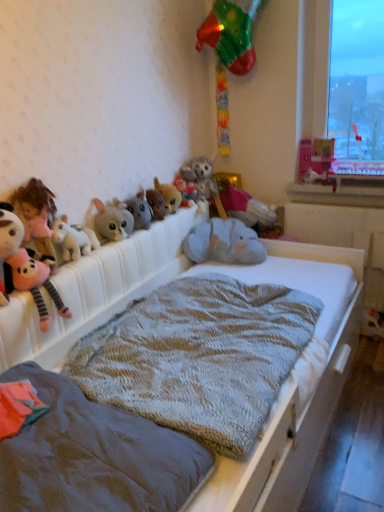
This screenshot has height=512, width=384. What are the coordinates of `fluffy pink doll at left, which is the 2th toy from left to right` in the screenshot? It's located at tap(36, 218).

The image size is (384, 512). Describe the element at coordinates (73, 239) in the screenshot. I see `white plush unicorn at left, which is the eighth toy in right-to-left order` at that location.

Where is `fluffy gray elephant at center, which is counted as the seventh toy, starting from the left`? The width and height of the screenshot is (384, 512). fluffy gray elephant at center, which is counted as the seventh toy, starting from the left is located at coordinates (186, 191).

What do you see at coordinates (186, 191) in the screenshot? This screenshot has height=512, width=384. I see `fluffy gray elephant at center, which is the 4th toy from right to left` at bounding box center [186, 191].

This screenshot has width=384, height=512. What do you see at coordinates (242, 281) in the screenshot?
I see `textured gray blanket at center` at bounding box center [242, 281].

Locate an element on the screen. fluffy gray stuffed animal at center is located at coordinates (199, 176).

I want to click on fluffy gray plush at center, the sixth toy when ordered from right to left, so click(x=140, y=210).

Locate an element on the screen. fluffy pink doll at left, which is the 2th toy from left to right is located at coordinates (36, 218).

Which of these two, fluffy gray plush at center, positioned as the 5th toy in left-to-right order, or textured gray blanket at center, is thinner?

With smaller width is fluffy gray plush at center, positioned as the 5th toy in left-to-right order.

Can you tell me how much fluffy gray plush at center, the sixth toy when ordered from right to left, and textured gray blanket at center differ in facing direction?

The facing directions of fluffy gray plush at center, the sixth toy when ordered from right to left, and textured gray blanket at center are 0.00123 degrees apart.

Is fluffy gray plush at center, the sixth toy when ordered from right to left, bigger than textured gray blanket at center?

Actually, fluffy gray plush at center, the sixth toy when ordered from right to left, might be smaller than textured gray blanket at center.

From the image's perspective, which one is positioned higher, fluffy gray plush at center, the sixth toy when ordered from right to left, or pink plush toy at left, acting as the tenth toy starting from the right?

fluffy gray plush at center, the sixth toy when ordered from right to left, from the image's perspective.

Who is bigger, fluffy gray plush at center, the sixth toy when ordered from right to left, or pink plush toy at left, which is counted as the first toy, starting from the left?

Bigger between the two is fluffy gray plush at center, the sixth toy when ordered from right to left.

Is fluffy gray plush at center, the sixth toy when ordered from right to left, not near pink plush toy at left, which is counted as the first toy, starting from the left?

fluffy gray plush at center, the sixth toy when ordered from right to left, is near pink plush toy at left, which is counted as the first toy, starting from the left, not far away.

From a real-world perspective, which is physically above, fluffy gray plush at center, the sixth toy when ordered from right to left, or pink plush toy at left, acting as the tenth toy starting from the right?

In real-world perspective, pink plush toy at left, acting as the tenth toy starting from the right, is above.

Does pink plush toy at left, which is counted as the first toy, starting from the left, lie behind textured gray blanket at center, marked as the first blanket in a back-to-front arrangement?

Yes, it is.

Does pink plush toy at left, acting as the tenth toy starting from the right, have a lesser width compared to textured gray blanket at center, marked as the first blanket in a back-to-front arrangement?

Indeed, pink plush toy at left, acting as the tenth toy starting from the right, has a lesser width compared to textured gray blanket at center, marked as the first blanket in a back-to-front arrangement.

Considering the relative positions of pink plush toy at left, which is counted as the first toy, starting from the left, and textured gray blanket at center, marked as the first blanket in a back-to-front arrangement, in the image provided, is pink plush toy at left, which is counted as the first toy, starting from the left, to the left or to the right of textured gray blanket at center, marked as the first blanket in a back-to-front arrangement,?

From the image, it's evident that pink plush toy at left, which is counted as the first toy, starting from the left, is to the left of textured gray blanket at center, marked as the first blanket in a back-to-front arrangement.

There is a textured gray blanket at center, arranged as the 2th blanket when viewed from the front. At what (x,y) coordinates should I click in order to perform the action: click on the 1st toy above it (from the image's perspective). Please return your answer as a coordinate pair (x, y). Looking at the image, I should click on (x=8, y=247).

Between fluffy gray elephant at center, which is counted as the seventh toy, starting from the left, and fluffy gray plush at center, the 7th toy viewed from the right, which one has larger size?

With larger size is fluffy gray plush at center, the 7th toy viewed from the right.

Is fluffy gray elephant at center, which is counted as the seventh toy, starting from the left, positioned with its back to fluffy gray plush at center, which appears as the fourth toy when viewed from the left?

No.

From the image's perspective, which is above, fluffy gray elephant at center, which is counted as the seventh toy, starting from the left, or fluffy gray plush at center, the 7th toy viewed from the right?

From the image's view, fluffy gray elephant at center, which is counted as the seventh toy, starting from the left, is above.

Is point (7, 222) closer or farther from the camera than point (191, 195)?

Point (7, 222) is closer to the camera than point (191, 195).

Looking at this image, from a real-world perspective, between pink plush toy at left, acting as the tenth toy starting from the right, and fluffy gray elephant at center, which is counted as the seventh toy, starting from the left, who is vertically higher?

From a 3D spatial view, pink plush toy at left, acting as the tenth toy starting from the right, is above.

From the picture: What's the angular difference between pink plush toy at left, acting as the tenth toy starting from the right, and fluffy gray elephant at center, which is counted as the seventh toy, starting from the left,'s facing directions?

The angle between the facing direction of pink plush toy at left, acting as the tenth toy starting from the right, and the facing direction of fluffy gray elephant at center, which is counted as the seventh toy, starting from the left, is 5.29 degrees.

Is pink plush toy at left, which is counted as the first toy, starting from the left, taller than fluffy gray elephant at center, which is the 4th toy from right to left?

Correct, pink plush toy at left, which is counted as the first toy, starting from the left, is much taller as fluffy gray elephant at center, which is the 4th toy from right to left.

Based on their sizes in the image, would you say fluffy gray elephant at center, which is the 4th toy from right to left, is bigger or smaller than brown plush toy at upper center, positioned as the sixth toy in left-to-right order?

Considering their sizes, fluffy gray elephant at center, which is the 4th toy from right to left, takes up less space than brown plush toy at upper center, positioned as the sixth toy in left-to-right order.

Is brown plush toy at upper center, positioned as the 5th toy in right-to-left order, inside fluffy gray elephant at center, which is counted as the seventh toy, starting from the left?

That's incorrect, brown plush toy at upper center, positioned as the 5th toy in right-to-left order, is not inside fluffy gray elephant at center, which is counted as the seventh toy, starting from the left.

Could you measure the distance between fluffy gray elephant at center, which is counted as the seventh toy, starting from the left, and brown plush toy at upper center, positioned as the sixth toy in left-to-right order?

fluffy gray elephant at center, which is counted as the seventh toy, starting from the left, is 3.64 inches from brown plush toy at upper center, positioned as the sixth toy in left-to-right order.

Is fluffy gray elephant at center, which is the 4th toy from right to left, turned away from brown plush toy at upper center, positioned as the 5th toy in right-to-left order?

fluffy gray elephant at center, which is the 4th toy from right to left, does not have its back to brown plush toy at upper center, positioned as the 5th toy in right-to-left order.

How distant is fluffy gray plush at center, which appears as the fourth toy when viewed from the left, from fluffy gray stuffed animal at center?

64.47 centimeters.

Consider the image. Is fluffy gray stuffed animal at center completely or partially inside fluffy gray plush at center, the 7th toy viewed from the right?

No, fluffy gray plush at center, the 7th toy viewed from the right, does not contain fluffy gray stuffed animal at center.

Is fluffy gray plush at center, the 7th toy viewed from the right, smaller than fluffy gray stuffed animal at center?

Yes, fluffy gray plush at center, the 7th toy viewed from the right, is smaller than fluffy gray stuffed animal at center.

Find the location of a particular element. This screenshot has width=384, height=512. the 5th toy behind the textured gray blanket at center, starting your count from the anchor is located at coordinates (140, 210).

From a real-world perspective, starting from the pink plush toy at left, acting as the tenth toy starting from the right, which toy is the 2nd one below it? Please provide its 2D coordinates.

[(140, 210)]

Looking at the image, which one is located closer to fluffy gray elephant at center, which is the 4th toy from right to left, fluffy gray stuffed animal at center or pink plush toy at left, acting as the tenth toy starting from the right?

The object closer to fluffy gray elephant at center, which is the 4th toy from right to left, is fluffy gray stuffed animal at center.

From the image, which object appears to be nearer to fluffy gray stuffed animal at center, knitted gray blanket at center, which is the first blanket from front to back, or fluffy gray plush at center, the sixth toy when ordered from right to left?

Among the two, fluffy gray plush at center, the sixth toy when ordered from right to left, is located nearer to fluffy gray stuffed animal at center.

Based on their spatial positions, is pink cardboard box at upper right, the 10th toy viewed from the left, or fluffy gray plush at center, the 7th toy viewed from the right, further from brown plush toy at upper center, positioned as the 5th toy in right-to-left order?

pink cardboard box at upper right, the 10th toy viewed from the left, is positioned further to the anchor brown plush toy at upper center, positioned as the 5th toy in right-to-left order.

From the picture: From the image, which object appears to be nearer to fluffy gray elephant at center, which is the 4th toy from right to left, brown plush toy at upper center, positioned as the sixth toy in left-to-right order, or gray plush elephant at center, the third toy viewed from the right?

Based on the image, brown plush toy at upper center, positioned as the sixth toy in left-to-right order, appears to be nearer to fluffy gray elephant at center, which is the 4th toy from right to left.

Considering their positions, is pink plush toy at left, which is counted as the first toy, starting from the left, positioned closer to gray plush elephant at center, the 8th toy in the left-to-right sequence, than fluffy pink doll at left, which is the 2th toy from left to right?

fluffy pink doll at left, which is the 2th toy from left to right, lies closer to gray plush elephant at center, the 8th toy in the left-to-right sequence, than the other object.

Estimate the real-world distances between objects in this image. Which object is closer to fluffy pink doll at left, which is the 2th toy from left to right, brown plush toy at upper center, positioned as the 5th toy in right-to-left order, or fluffy gray plush at center, which appears as the fourth toy when viewed from the left?

Among the two, fluffy gray plush at center, which appears as the fourth toy when viewed from the left, is located nearer to fluffy pink doll at left, which is the 2th toy from left to right.

From the image, which object appears to be nearer to gray plush elephant at upper center, which ranks as the 9th toy in left-to-right order, fluffy gray stuffed animal at center or textured gray blanket at center, arranged as the 2th blanket when viewed from the front?

Based on the image, fluffy gray stuffed animal at center appears to be nearer to gray plush elephant at upper center, which ranks as the 9th toy in left-to-right order.

When comparing their distances from textured gray blanket at center, arranged as the 2th blanket when viewed from the front, does pink cardboard box at upper right, the 10th toy viewed from the left, or brown plush toy at upper center, positioned as the 5th toy in right-to-left order, seem further?

pink cardboard box at upper right, the 10th toy viewed from the left.

Identify the location of animal between brown plush toy at upper center, positioned as the sixth toy in left-to-right order, and white plastic window sill at lower right from left to right. This screenshot has width=384, height=512. (199, 176).

The image size is (384, 512). I want to click on toy between knitted gray blanket at center, which is the first blanket from front to back, and fluffy pink doll at left, placed as the ninth toy when sorted from right to left, in the front-back direction, so click(8, 247).

I want to click on toy between fluffy gray elephant at center, which is the 4th toy from right to left, and gray plush elephant at upper center, marked as the second toy in a right-to-left arrangement, from left to right, so (x=224, y=243).

The width and height of the screenshot is (384, 512). Find the location of `animal located between fluffy pink doll at left, placed as the ninth toy when sorted from right to left, and pink cardboard box at upper right, the first toy viewed from the right, in the left-right direction`. animal located between fluffy pink doll at left, placed as the ninth toy when sorted from right to left, and pink cardboard box at upper right, the first toy viewed from the right, in the left-right direction is located at coordinates (199, 176).